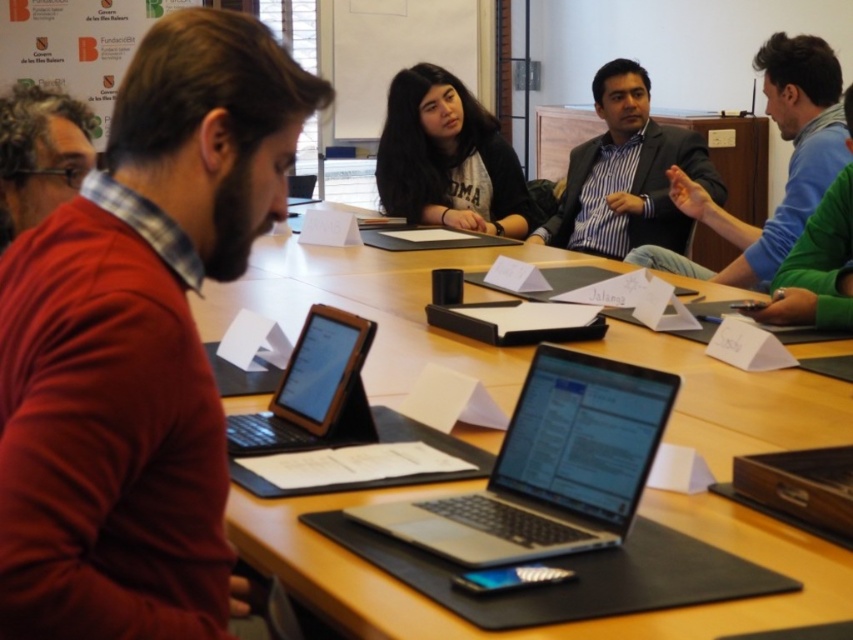
Which is more to the left, black matte tablet at center or blue-green sweater at right?

black matte tablet at center

Can you confirm if black matte tablet at center is positioned below blue-green sweater at right?

Yes.

Which is in front, point (352, 385) or point (759, 310)?

Point (352, 385)

What are the coordinates of `black matte tablet at center` in the screenshot? It's located at (312, 392).

Does silver metallic laptop at center appear under blue shirt at upper right?

Indeed, silver metallic laptop at center is positioned under blue shirt at upper right.

Is point (646, 435) in front of point (630, 260)?

Yes, point (646, 435) is closer to viewer.

The height and width of the screenshot is (640, 853). What are the coordinates of `silver metallic laptop at center` in the screenshot? It's located at (549, 467).

Is matte red sweater at left positioned in front of dark gray suit at center?

Yes, matte red sweater at left is in front of dark gray suit at center.

Is matte red sweater at left shorter than dark gray suit at center?

Correct, matte red sweater at left is not as tall as dark gray suit at center.

Does point (172, 572) come behind point (561, 200)?

No, it is not.

Locate an element on the screen. matte red sweater at left is located at coordinates (138, 340).